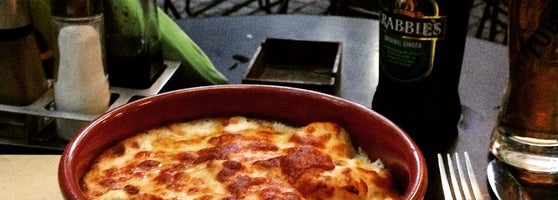
Where is `fork`? Image resolution: width=558 pixels, height=200 pixels. fork is located at coordinates (460, 176).